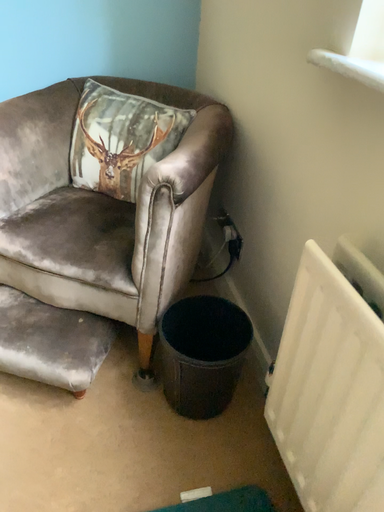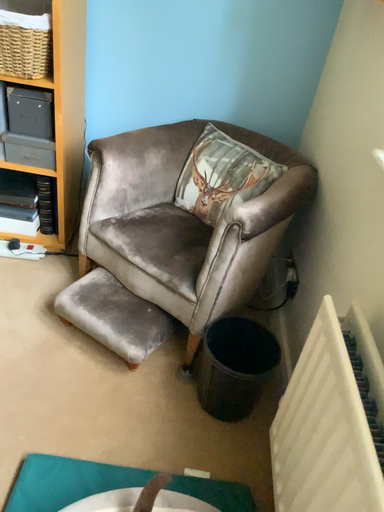
Question: How did the camera likely rotate when shooting the video?

Choices:
 (A) rotated right
 (B) rotated left

Answer: (B)